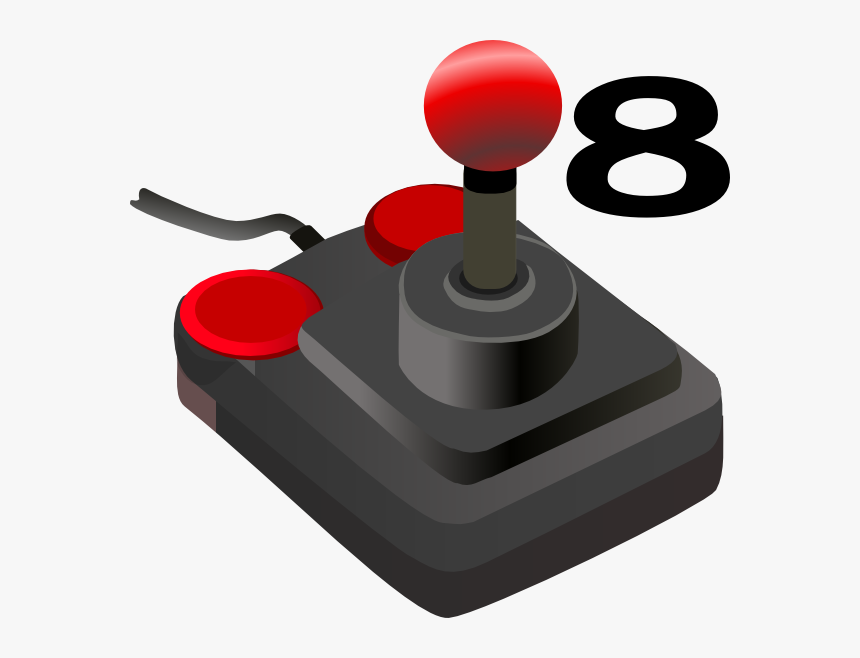
Where is `rod`? rod is located at coordinates (492, 255).